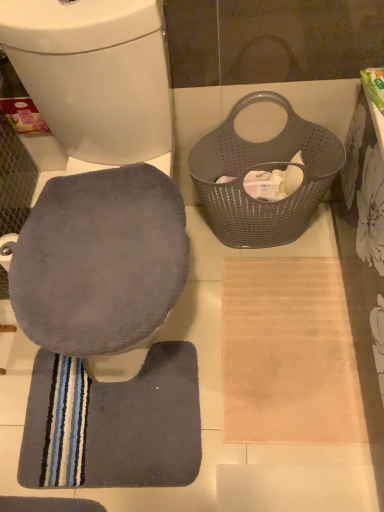
Question: Looking at their shapes, would you say dark gray plush bath mat at lower left is wider or thinner than gray perforated laundry basket at upper right?

Choices:
 (A) wide
 (B) thin

Answer: (A)

Question: From the image's perspective, is dark gray plush bath mat at lower left located above or below gray perforated laundry basket at upper right?

Choices:
 (A) below
 (B) above

Answer: (A)

Question: Which of these objects is positioned farthest from the dark gray plush bath mat at lower left?

Choices:
 (A) gray fabric toilet seat at lower left
 (B) gray perforated laundry basket at upper right

Answer: (A)

Question: Which is nearer to the gray fabric toilet seat at lower left?

Choices:
 (A) gray perforated laundry basket at upper right
 (B) dark gray plush bath mat at lower left

Answer: (A)